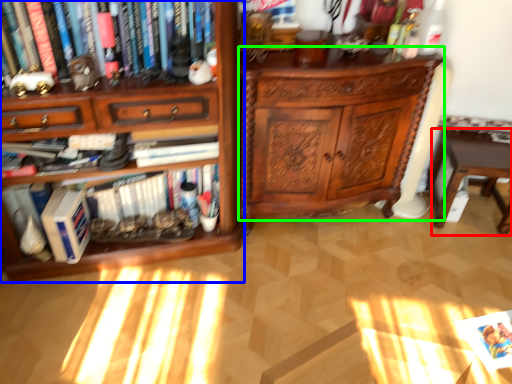
Question: Which object is the farthest from table (highlighted by a red box)? Choose among these: bookcase (highlighted by a blue box) or chest of drawers (highlighted by a green box).

Choices:
 (A) bookcase
 (B) chest of drawers

Answer: (A)